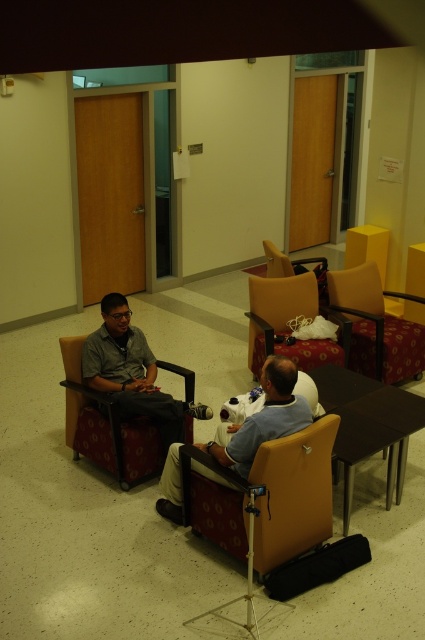
In the scene shown: Measure the distance between matte gray shirt at center and velvet-like brown armchair at center.

matte gray shirt at center and velvet-like brown armchair at center are 5.07 feet apart from each other.

Consider the image. Is matte gray shirt at center to the right of velvet-like brown armchair at center from the viewer's perspective?

No, matte gray shirt at center is not to the right of velvet-like brown armchair at center.

You are a GUI agent. You are given a task and a screenshot of the screen. Output one action in this format:
    pyautogui.click(x=<x>, y=<y>)
    Task: Click on the matte gray shirt at center
    The image size is (425, 640).
    Given the screenshot: What is the action you would take?
    pyautogui.click(x=130, y=371)

Find the location of `matte gray shirt at center`. matte gray shirt at center is located at coordinates (130, 371).

At what (x,y) coordinates should I click in order to perform the action: click on velvet-like brown armchair at left. Please return your answer as a coordinate pair (x, y). This screenshot has height=640, width=425. Looking at the image, I should click on (105, 426).

Can you confirm if velvet-like brown armchair at left is positioned to the right of matte gray shirt at center?

No, velvet-like brown armchair at left is not to the right of matte gray shirt at center.

Is point (71, 429) positioned after point (95, 381)?

Yes.

Locate an element on the screen. This screenshot has width=425, height=640. velvet-like brown armchair at left is located at coordinates (105, 426).

Does matte gray shirt at center appear over light blue fabric shirt at center?

Yes.

Which is more to the right, matte gray shirt at center or light blue fabric shirt at center?

light blue fabric shirt at center

Measure the distance between point (121, 342) and camera.

Point (121, 342) and camera are 4.81 meters apart from each other.

This screenshot has height=640, width=425. What are the coordinates of `matte gray shirt at center` in the screenshot? It's located at click(x=130, y=371).